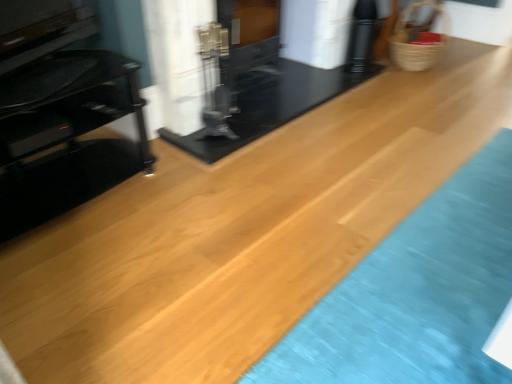
Question: Which direction should I rotate to look at black glossy fireplace at center, which is counted as the 1th fireplace, starting from the right?

Choices:
 (A) left
 (B) right

Answer: (B)

Question: Can you confirm if woven straw basket at upper right is thinner than black glossy fireplace at center, the first fireplace viewed from the left?

Choices:
 (A) no
 (B) yes

Answer: (A)

Question: Can you confirm if woven straw basket at upper right is bigger than black glossy fireplace at center, the first fireplace viewed from the left?

Choices:
 (A) yes
 (B) no

Answer: (B)

Question: Is woven straw basket at upper right oriented away from black glossy fireplace at center, marked as the 2th fireplace in a right-to-left arrangement?

Choices:
 (A) no
 (B) yes

Answer: (A)

Question: From the image's perspective, is woven straw basket at upper right beneath black glossy fireplace at center, marked as the 2th fireplace in a right-to-left arrangement?

Choices:
 (A) no
 (B) yes

Answer: (A)

Question: From the image's perspective, is woven straw basket at upper right above black glossy fireplace at center, the first fireplace viewed from the left?

Choices:
 (A) yes
 (B) no

Answer: (A)

Question: From a real-world perspective, is woven straw basket at upper right positioned under black glossy fireplace at center, the first fireplace viewed from the left, based on gravity?

Choices:
 (A) no
 (B) yes

Answer: (B)

Question: From the image's perspective, is woven straw basket at upper right on black glass tv stand at left?

Choices:
 (A) no
 (B) yes

Answer: (B)

Question: Is woven straw basket at upper right shorter than black glass tv stand at left?

Choices:
 (A) yes
 (B) no

Answer: (A)

Question: Is woven straw basket at upper right outside of black glass tv stand at left?

Choices:
 (A) yes
 (B) no

Answer: (A)

Question: Does woven straw basket at upper right have a smaller size compared to black glass tv stand at left?

Choices:
 (A) no
 (B) yes

Answer: (B)

Question: From a real-world perspective, is woven straw basket at upper right located higher than black glass tv stand at left?

Choices:
 (A) yes
 (B) no

Answer: (B)

Question: Is woven straw basket at upper right next to black glass tv stand at left and touching it?

Choices:
 (A) no
 (B) yes

Answer: (A)

Question: From a real-world perspective, is black glass tv stand at left located higher than woven straw basket at upper right?

Choices:
 (A) no
 (B) yes

Answer: (B)